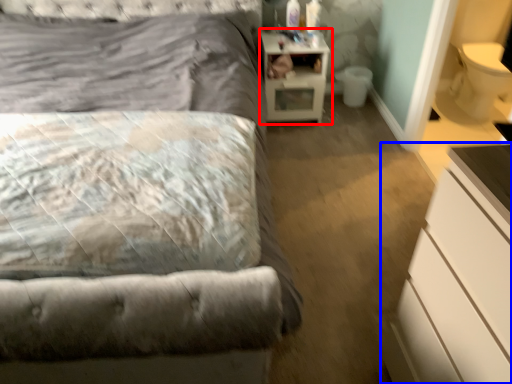
Question: Which point is further to the camera, nightstand (highlighted by a red box) or chest of drawers (highlighted by a blue box)?

Choices:
 (A) nightstand
 (B) chest of drawers

Answer: (A)